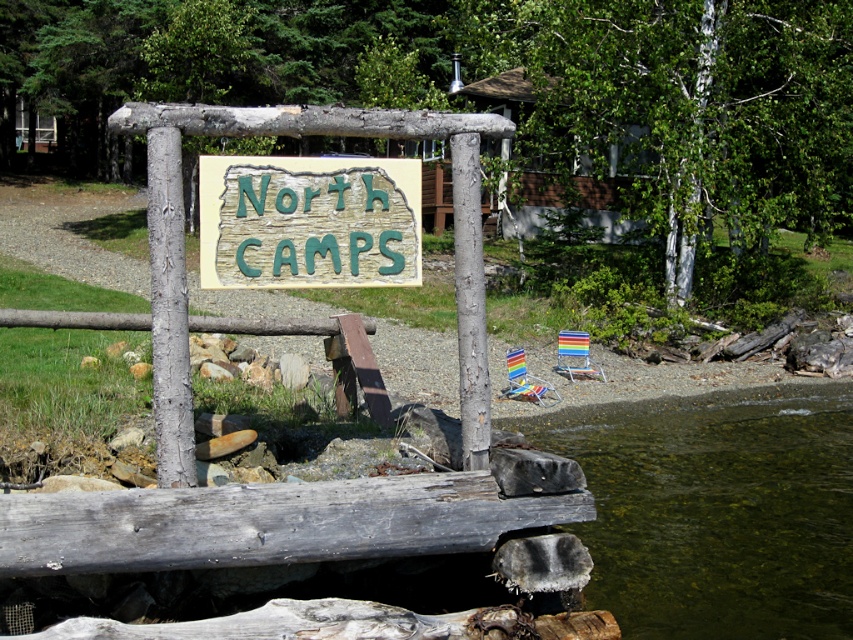
Question: Does green carved wood sign at center appear on the right side of gray textured pole at center?

Choices:
 (A) no
 (B) yes

Answer: (B)

Question: Among these objects, which one is nearest to the camera?

Choices:
 (A) weathered wood dock at lower center
 (B) green carved wood sign at center

Answer: (A)

Question: Which of these objects is positioned closest to the green carved wood sign at center?

Choices:
 (A) clear water at lower right
 (B) wooden sign at center

Answer: (B)

Question: Is gray textured pole at center above white smooth pole at center?

Choices:
 (A) yes
 (B) no

Answer: (B)

Question: Which point is closer to the camera taking this photo?

Choices:
 (A) (149, 202)
 (B) (831, 568)

Answer: (A)

Question: Is gray textured pole at center further to the viewer compared to white smooth pole at center?

Choices:
 (A) no
 (B) yes

Answer: (A)